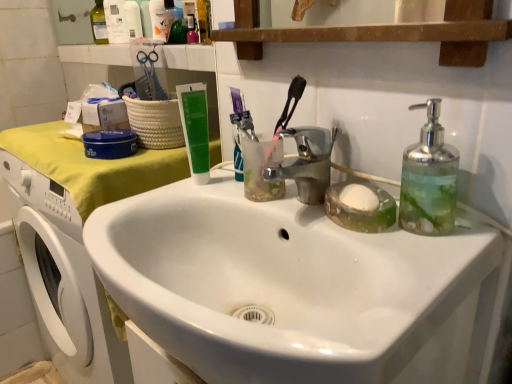
Locate an element on the screen. vacant area that is in front of green matte tube at upper center is located at coordinates (193, 201).